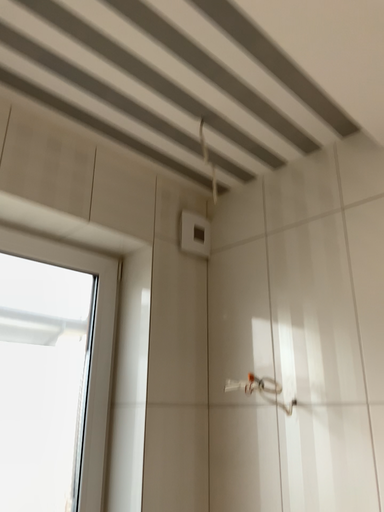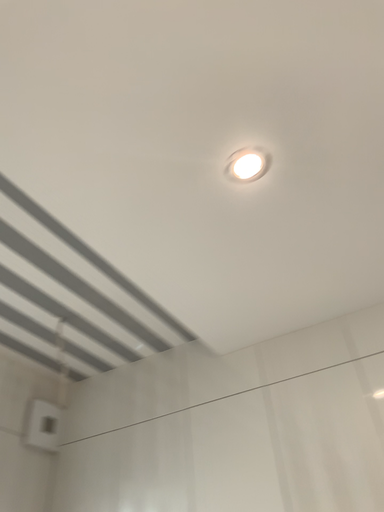
Question: Which way did the camera rotate in the video?

Choices:
 (A) rotated right
 (B) rotated left

Answer: (A)